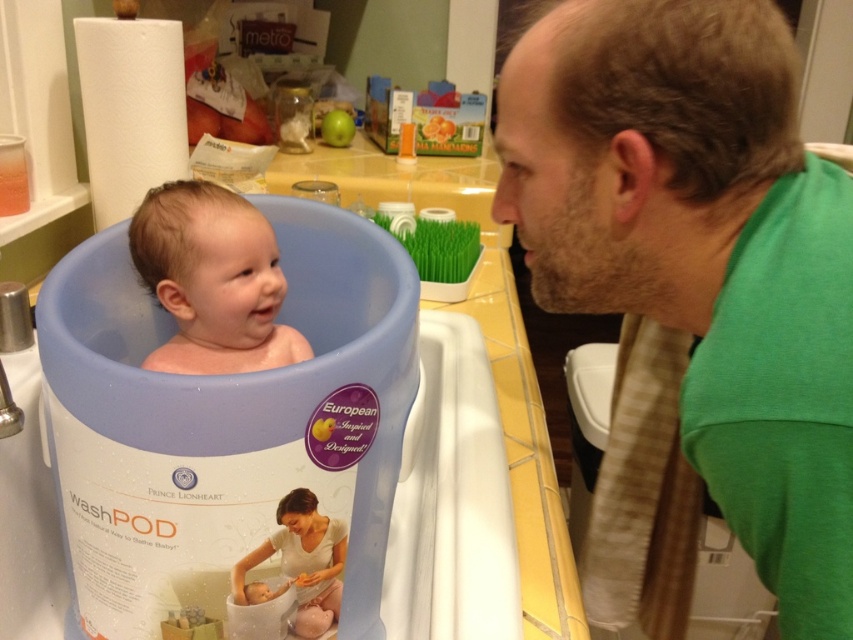
Is green fabric shirt at upper right above smooth plastic baby in tub at left?

Incorrect, green fabric shirt at upper right is not positioned above smooth plastic baby in tub at left.

What do you see at coordinates (671, 262) in the screenshot? The image size is (853, 640). I see `green fabric shirt at upper right` at bounding box center [671, 262].

Locate an element on the screen. The image size is (853, 640). green fabric shirt at upper right is located at coordinates (671, 262).

Is smooth plastic baby in tub at left smaller than soft white fabric baby at center?

No, smooth plastic baby in tub at left is not smaller than soft white fabric baby at center.

Between smooth plastic baby in tub at left and soft white fabric baby at center, which one is positioned lower?

Positioned lower is soft white fabric baby at center.

Does point (231, 349) lie in front of point (296, 627)?

No, (231, 349) is behind (296, 627).

Where is `smooth plastic baby in tub at left`? This screenshot has width=853, height=640. smooth plastic baby in tub at left is located at coordinates (212, 280).

Is white plastic sink at lower center below smooth plastic baby in tub at left?

Yes, white plastic sink at lower center is below smooth plastic baby in tub at left.

Who is more forward, (276, 476) or (218, 317)?

Point (276, 476) is more forward.

This screenshot has width=853, height=640. Find the location of `white plastic sink at lower center`. white plastic sink at lower center is located at coordinates 277,442.